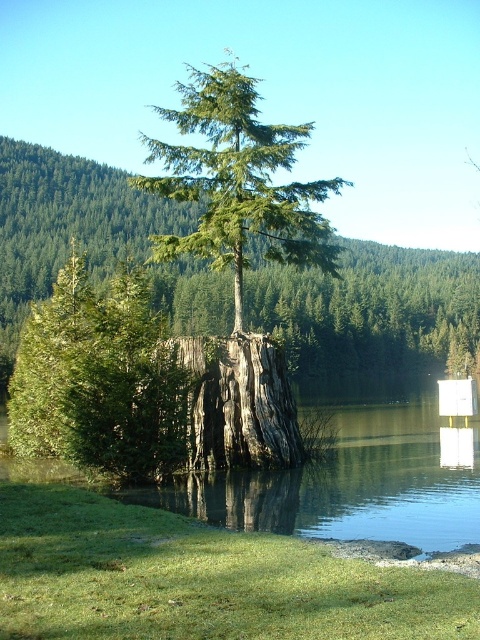
Consider the image. You are an environmental scientist assessing the health of this ecosystem. You notice the clear water at center and the dark gray rough tree trunk at center. Which of these two features occupies a wider area in the scene?

The clear water at center has a larger width than the dark gray rough tree trunk at center, so it occupies a wider area in the scene.

You are a hiker who wants to take a photo of both the green rough bark tree at center and the dark gray rough tree trunk at center. Which one should you stand closer to in order to capture both in the frame without zooming?

You should stand closer to the dark gray rough tree trunk at center because the green rough bark tree at center is taller than it, so moving closer to the shorter one allows both to fit in the frame without zooming.

You are a nature photographer planning to capture the green rough bark tree at center and the clear water at center in a single shot. Based on their sizes, which object would appear smaller in the photo?

The green rough bark tree at center appears smaller in the photo because it has a lesser width compared to the clear water at center.